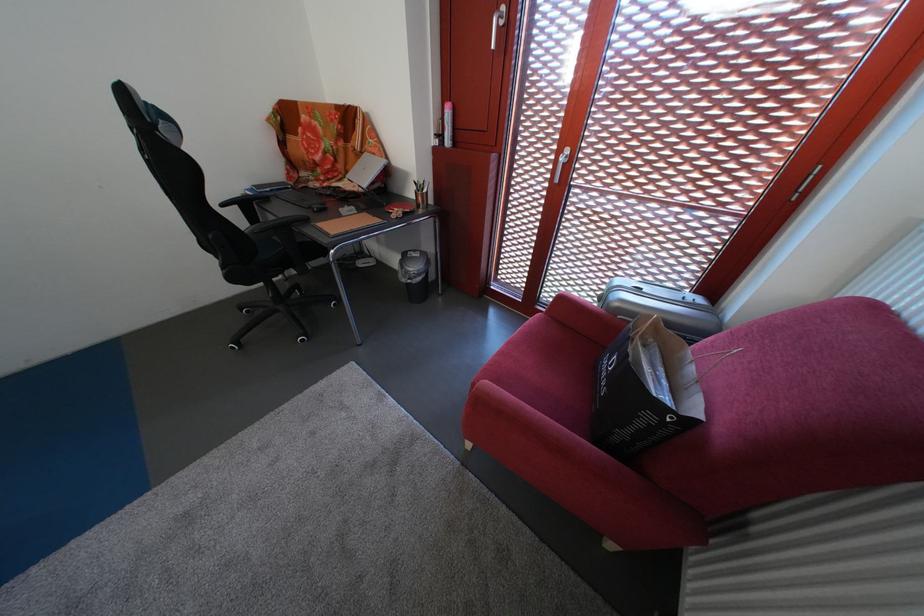
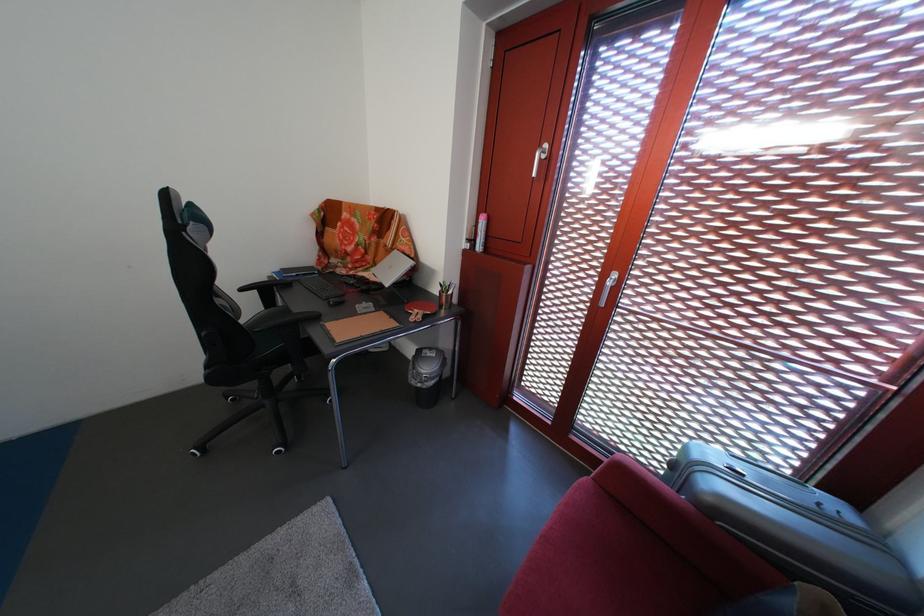
Where in the second image is the point corresponding to pixel 415 286 from the first image?

(424, 389)